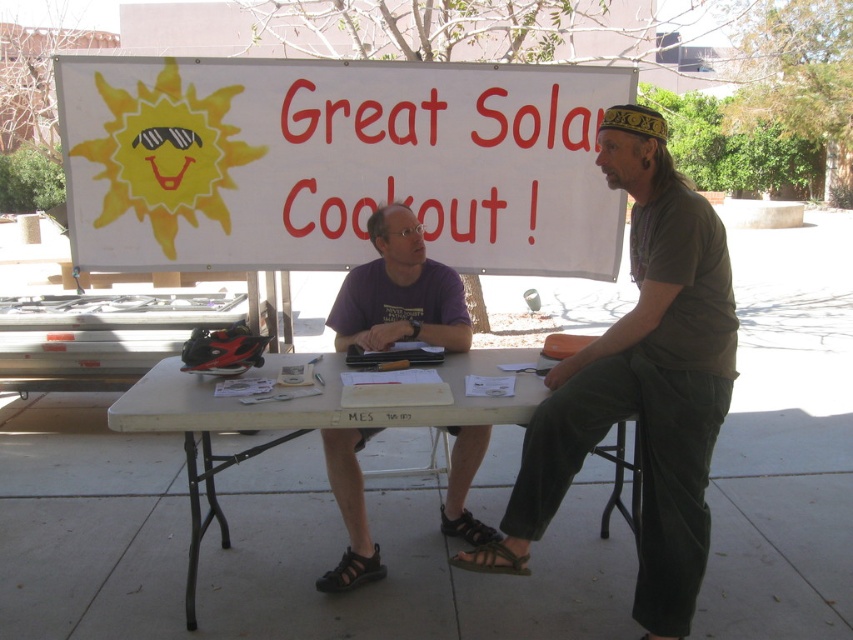
You are standing at the edge of the Great Solar Cookout event area. There is a point marked at coordinates (492, 557). What object is located at this point?

The point at coordinates (492, 557) corresponds to the brown leather sandal at lower center.

You are a photographer standing at the edge of the scene. You need to capture a photo where both the purple cotton shirt at center and the brown leather sandal at lower center are clearly visible. Based on their heights, which object might be partially obscured if the camera angle is too low?

The purple cotton shirt at center is much taller than the brown leather sandal at lower center, so if the camera angle is too low, the purple cotton shirt at center might partially obscure the view of the brown leather sandal at lower center.

You are standing in front of the folding table at the Great Solar Cookout event. You notice two sandals at the lower center of your view. Which sandal is nearer to you, the brown leather sandal at lower center or the black rubber sandal at lower center?

The brown leather sandal at lower center is closer to the viewer than the black rubber sandal at lower center.